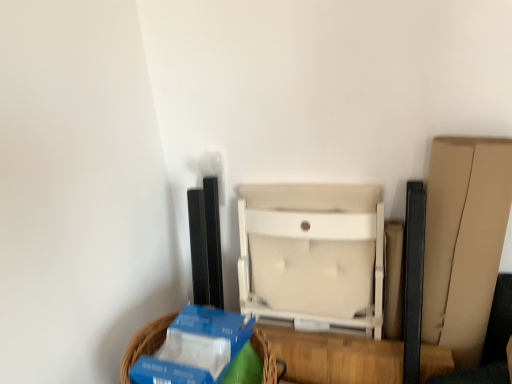
Consider the image. In order to face beige fabric chair at center, should I rotate leftwards or rightwards?

Rotate right and turn 7.159 degrees.

What do you see at coordinates (312, 254) in the screenshot? The height and width of the screenshot is (384, 512). I see `beige fabric chair at center` at bounding box center [312, 254].

Where is `beige fabric chair at center`? beige fabric chair at center is located at coordinates (312, 254).

What do you see at coordinates (145, 343) in the screenshot? I see `blue cardboard basket at lower left` at bounding box center [145, 343].

Identify the location of blue cardboard basket at lower left. (145, 343).

This screenshot has width=512, height=384. Identify the location of beige fabric chair at center. (312, 254).

Considering the positions of objects beige fabric chair at center and blue cardboard basket at lower left in the image provided, who is more to the left, beige fabric chair at center or blue cardboard basket at lower left?

From the viewer's perspective, blue cardboard basket at lower left appears more on the left side.

Is beige fabric chair at center positioned before blue cardboard basket at lower left?

No.

Considering the points (317, 291) and (122, 359), which point is behind, point (317, 291) or point (122, 359)?

Positioned behind is point (317, 291).

From the image's perspective, who appears lower, beige fabric chair at center or blue cardboard basket at lower left?

blue cardboard basket at lower left appears lower in the image.

From the picture: From a real-world perspective, is beige fabric chair at center positioned under blue cardboard basket at lower left based on gravity?

Yes, from a real-world perspective, beige fabric chair at center is under blue cardboard basket at lower left.

Does beige fabric chair at center have a lesser width compared to blue cardboard basket at lower left?

Yes, beige fabric chair at center is thinner than blue cardboard basket at lower left.

Is beige fabric chair at center shorter than blue cardboard basket at lower left?

Incorrect, the height of beige fabric chair at center does not fall short of that of blue cardboard basket at lower left.

Who is smaller, beige fabric chair at center or blue cardboard basket at lower left?

Smaller between the two is blue cardboard basket at lower left.

Looking at this image, is beige fabric chair at center situated inside blue cardboard basket at lower left or outside?

beige fabric chair at center is located beyond the bounds of blue cardboard basket at lower left.

Is beige fabric chair at center touching blue cardboard basket at lower left?

No, beige fabric chair at center is not in contact with blue cardboard basket at lower left.

Is blue cardboard basket at lower left at the back of beige fabric chair at center?

beige fabric chair at center does not have its back to blue cardboard basket at lower left.

In the scene shown: Can you tell me how much beige fabric chair at center and blue cardboard basket at lower left differ in facing direction?

beige fabric chair at center and blue cardboard basket at lower left are facing 8.9 degrees away from each other.

I want to click on basket located in front of the beige fabric chair at center, so click(x=145, y=343).

Considering the relative positions of blue cardboard basket at lower left and beige fabric chair at center in the image provided, is blue cardboard basket at lower left to the left or to the right of beige fabric chair at center?

blue cardboard basket at lower left is positioned on beige fabric chair at center's left side.

Is blue cardboard basket at lower left closer to the viewer compared to beige fabric chair at center?

Yes.

Is point (140, 341) closer to camera compared to point (361, 295)?

Yes, point (140, 341) is closer to viewer.

From the image's perspective, which one is positioned higher, blue cardboard basket at lower left or beige fabric chair at center?

beige fabric chair at center appears higher in the image.

From a real-world perspective, is blue cardboard basket at lower left physically below beige fabric chair at center?

Incorrect, from a real-world perspective, blue cardboard basket at lower left is higher than beige fabric chair at center.

Can you confirm if blue cardboard basket at lower left is thinner than beige fabric chair at center?

No, blue cardboard basket at lower left is not thinner than beige fabric chair at center.

Who is taller, blue cardboard basket at lower left or beige fabric chair at center?

beige fabric chair at center is taller.

Based on their sizes in the image, would you say blue cardboard basket at lower left is bigger or smaller than beige fabric chair at center?

In the image, blue cardboard basket at lower left appears to be smaller than beige fabric chair at center.

Is blue cardboard basket at lower left completely or partially outside of beige fabric chair at center?

Yes.

Is blue cardboard basket at lower left with beige fabric chair at center?

blue cardboard basket at lower left is not next to beige fabric chair at center, and they're not touching.

Is blue cardboard basket at lower left positioned with its back to beige fabric chair at center?

That's right, blue cardboard basket at lower left is facing away from beige fabric chair at center.

Can you tell me how much blue cardboard basket at lower left and beige fabric chair at center differ in facing direction?

The facing directions of blue cardboard basket at lower left and beige fabric chair at center are 8.9 degrees apart.

This screenshot has width=512, height=384. I want to click on furniture that appears above the blue cardboard basket at lower left (from the image's perspective), so click(x=312, y=254).

Where is `basket located above the beige fabric chair at center (from a real-world perspective)`? basket located above the beige fabric chair at center (from a real-world perspective) is located at coordinates (145, 343).

At what (x,y) coordinates should I click in order to perform the action: click on furniture that is above the blue cardboard basket at lower left (from the image's perspective). Please return your answer as a coordinate pair (x, y). Image resolution: width=512 pixels, height=384 pixels. Looking at the image, I should click on (312, 254).